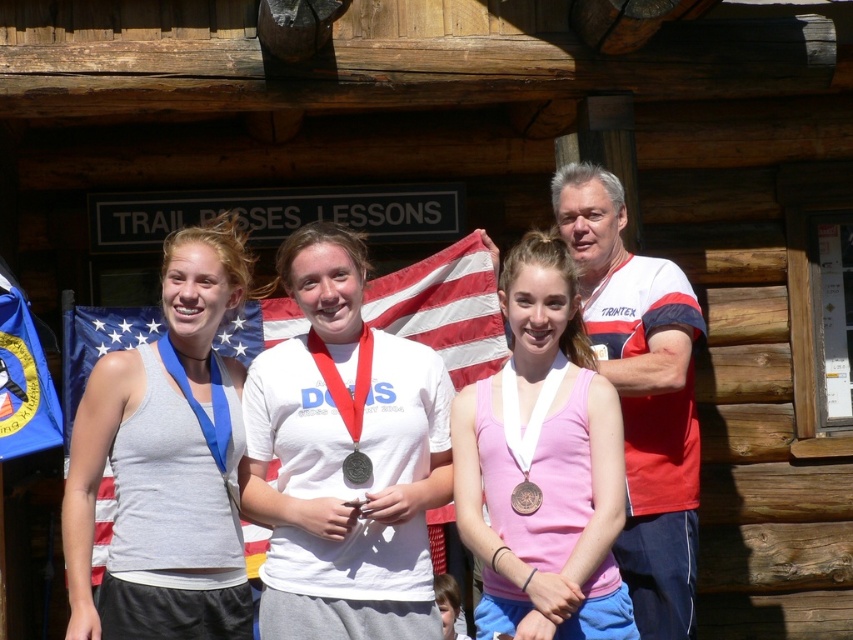
Question: Based on their relative distances, which object is farther from the blue fabric flag at left?

Choices:
 (A) matte gray tank top at center
 (B) white jersey at center
 (C) white cotton shirt at center
 (D) pink matte tank top at center

Answer: (C)

Question: Which of the following is the farthest from the observer?

Choices:
 (A) (360, 264)
 (B) (671, 577)
 (C) (364, 474)
 (D) (532, 497)

Answer: (A)

Question: Can you confirm if white matte shirt at center is positioned to the right of blue fabric flag at left?

Choices:
 (A) yes
 (B) no

Answer: (A)

Question: Considering the relative positions of white jersey at center and silver metallic medal at center in the image provided, where is white jersey at center located with respect to silver metallic medal at center?

Choices:
 (A) right
 (B) left

Answer: (A)

Question: Is matte gray tank top at center thinner than gold metallic medal at center?

Choices:
 (A) no
 (B) yes

Answer: (A)

Question: Estimate the real-world distances between objects in this image. Which object is closer to the white cotton shirt at center?

Choices:
 (A) blue fabric flag at left
 (B) pink matte tank top at center
 (C) white matte shirt at center

Answer: (B)